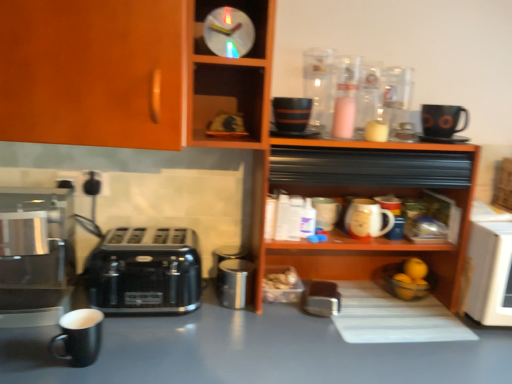
Question: Is matte ceramic mug at shelf center bigger or smaller than translucent plastic clock at upper center?

Choices:
 (A) small
 (B) big

Answer: (A)

Question: Considering the positions of point (380, 216) and point (220, 26), is point (380, 216) closer or farther from the camera than point (220, 26)?

Choices:
 (A) closer
 (B) farther

Answer: (B)

Question: Which object is the farthest from the matte ceramic mug at shelf center?

Choices:
 (A) wooden cabinet at upper left, the first cabinetry in the left-to-right sequence
 (B) matte wooden plate at upper center, which is the first cabinetry in right-to-left order
 (C) black matte table at lower left
 (D) translucent plastic clock at upper center
 (E) shiny metallic coffee maker at left

Answer: (E)

Question: Which of these objects is positioned farthest from the matte wooden plate at upper center, which is the first cabinetry in right-to-left order?

Choices:
 (A) shiny metallic coffee maker at left
 (B) translucent plastic clock at upper center
 (C) black matte table at lower left
 (D) metallic silver canister at center
 (E) black plastic toaster at lower left

Answer: (C)